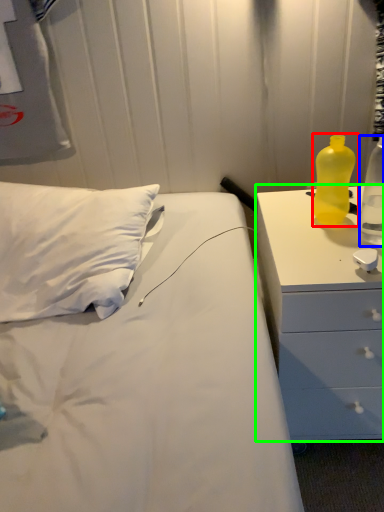
Question: Which object is the closest to the bottle (highlighted by a red box)? Choose among these: bottle (highlighted by a blue box) or chest of drawers (highlighted by a green box).

Choices:
 (A) bottle
 (B) chest of drawers

Answer: (A)